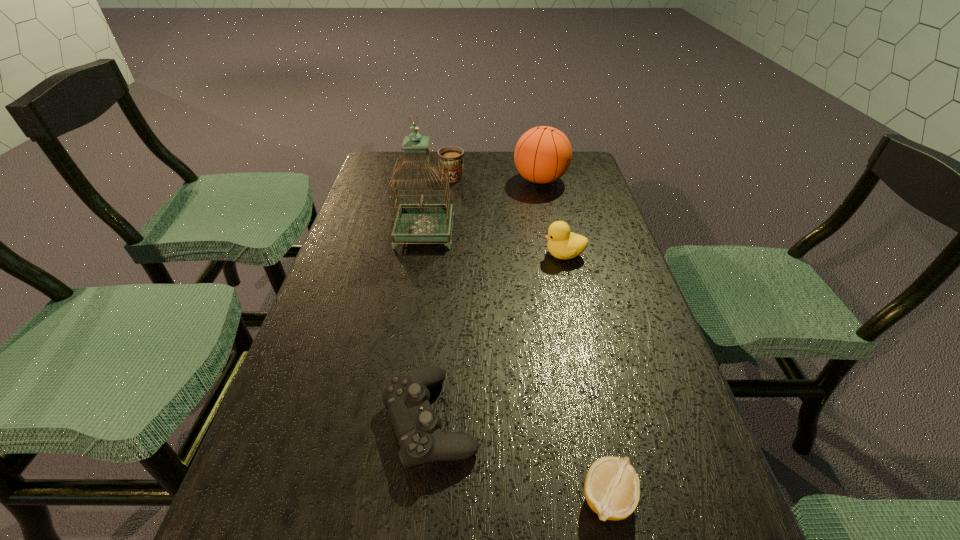
Identify the location of birdcage. The image size is (960, 540). [421, 222].

This screenshot has width=960, height=540. Identify the location of basketball. (543, 154).

Locate an element on the screen. The image size is (960, 540). duck is located at coordinates (x=563, y=244).

Where is `mug`? mug is located at coordinates (454, 156).

Identify the location of the fifth tallest object. (418, 429).

Locate an element on the screen. the shortest object is located at coordinates (612, 489).

Where is `vacant area located 0.360m at the door of the tallest object`? vacant area located 0.360m at the door of the tallest object is located at coordinates (583, 232).

In order to click on free space located 0.240m on the front of the fifth shortest object in this screenshot , I will do `click(553, 240)`.

Find the location of a particular element. vacant space situated on the front-facing side of the duck is located at coordinates (424, 254).

I want to click on vacant space located 0.390m on the front-facing side of the duck, so click(394, 254).